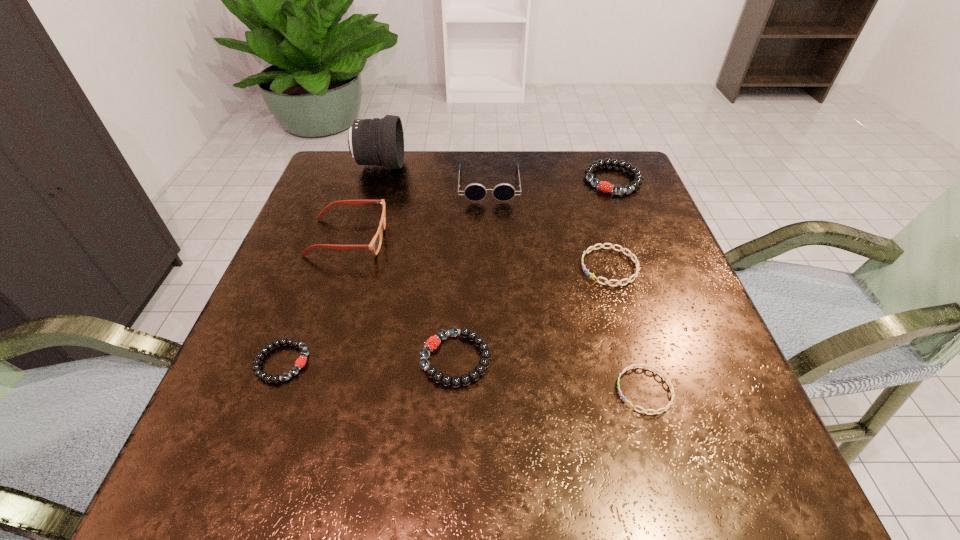
Find the location of a particular element. Image resolution: width=960 pixels, height=540 pixels. the leftmost black bracelet is located at coordinates (301, 361).

Find the location of a particular element. the leftmost bracelet is located at coordinates (301, 361).

Identify the location of the smaller blue bracelet. (670, 403).

This screenshot has width=960, height=540. In order to click on the shortest object in this screenshot , I will do `click(670, 403)`.

The image size is (960, 540). I want to click on vacant space located 0.130m at the front element of the black telephoto lens, so click(451, 166).

Identify the location of vacant space located 0.080m on the front-facing side of the sunglasses. (490, 224).

This screenshot has height=540, width=960. Find the location of `free space located on the front-facing side of the spectacles`. free space located on the front-facing side of the spectacles is located at coordinates (546, 238).

Where is `free location located on the front of the fourth tallest object`? free location located on the front of the fourth tallest object is located at coordinates (631, 227).

Where is `vacant space situated on the back of the fourth bracelet from right to left`? This screenshot has height=540, width=960. vacant space situated on the back of the fourth bracelet from right to left is located at coordinates (459, 274).

In order to click on free space located on the surface of the farther blue bracelet showing star-shaped elements in this screenshot , I will do `click(457, 267)`.